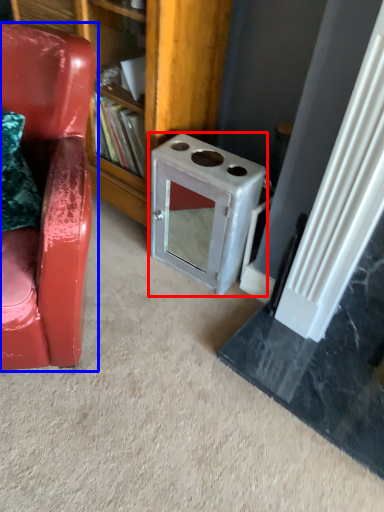
Question: Which object appears farthest to the camera in this image, appliance (highlighted by a red box) or chair (highlighted by a blue box)?

Choices:
 (A) appliance
 (B) chair

Answer: (A)